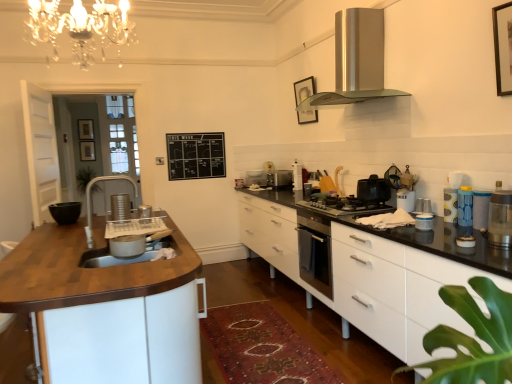
What are the coordinates of `vacant area on the back side of brushed metal faucet at left` in the screenshot? It's located at (120, 233).